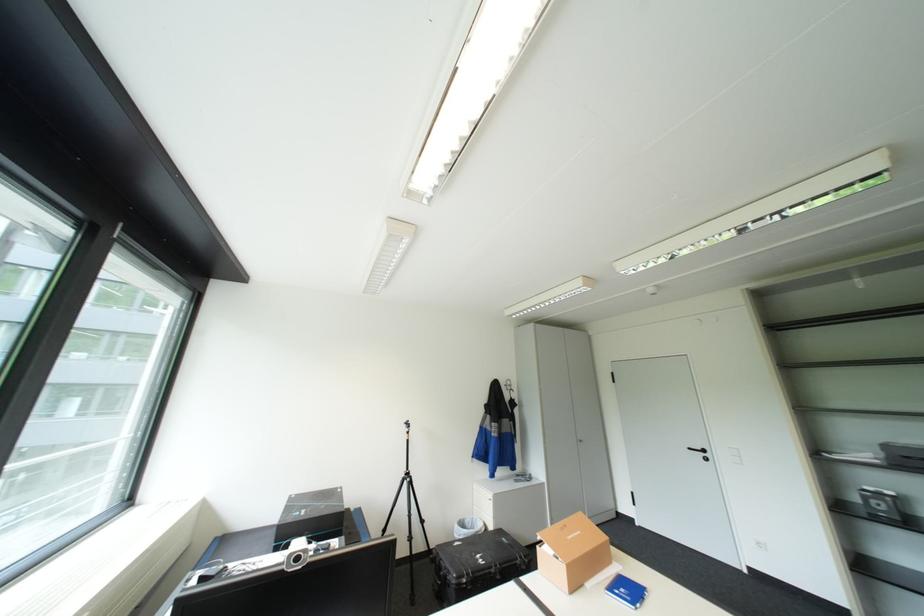
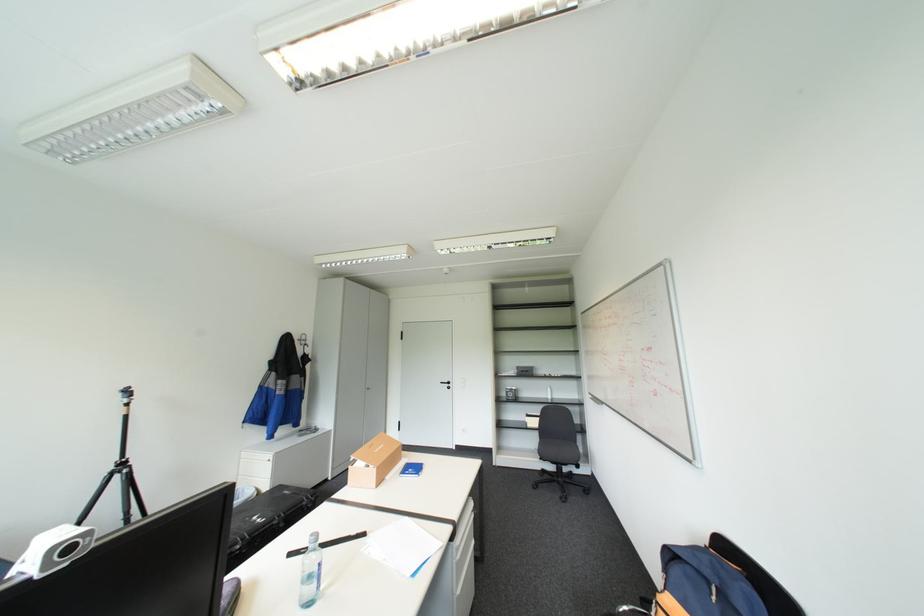
Where in the second image is the point corresponding to point (487, 554) from the first image?

(262, 517)